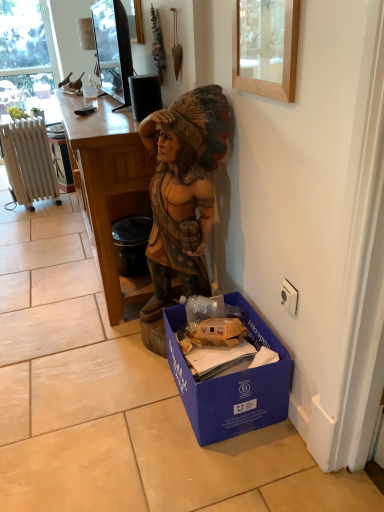
Question: Does white painted metal radiator at left have a lesser width compared to black glossy tv at upper center?

Choices:
 (A) no
 (B) yes

Answer: (A)

Question: Is the depth of white painted metal radiator at left less than that of black glossy tv at upper center?

Choices:
 (A) no
 (B) yes

Answer: (A)

Question: Is white painted metal radiator at left to the right of black glossy tv at upper center from the viewer's perspective?

Choices:
 (A) no
 (B) yes

Answer: (A)

Question: Is white painted metal radiator at left to the left of black glossy tv at upper center from the viewer's perspective?

Choices:
 (A) yes
 (B) no

Answer: (A)

Question: From the image's perspective, is white painted metal radiator at left on black glossy tv at upper center?

Choices:
 (A) yes
 (B) no

Answer: (B)

Question: Considering the positions of point (137, 151) and point (190, 415), is point (137, 151) closer or farther from the camera than point (190, 415)?

Choices:
 (A) farther
 (B) closer

Answer: (A)

Question: From a real-world perspective, is wooden desk at center above or below blue cardboard box at lower right?

Choices:
 (A) below
 (B) above

Answer: (B)

Question: Is wooden desk at center to the left or to the right of blue cardboard box at lower right in the image?

Choices:
 (A) left
 (B) right

Answer: (A)

Question: Relative to blue cardboard box at lower right, is wooden desk at center in front or behind?

Choices:
 (A) behind
 (B) front

Answer: (A)

Question: Based on their positions, is white painted metal radiator at left located to the left or right of wooden desk at center?

Choices:
 (A) left
 (B) right

Answer: (A)

Question: Relative to wooden desk at center, is white painted metal radiator at left in front or behind?

Choices:
 (A) behind
 (B) front

Answer: (A)

Question: From the image's perspective, is white painted metal radiator at left located above or below wooden desk at center?

Choices:
 (A) above
 (B) below

Answer: (A)

Question: In terms of width, does white painted metal radiator at left look wider or thinner when compared to wooden desk at center?

Choices:
 (A) thin
 (B) wide

Answer: (A)

Question: Relative to black glossy tv at upper center, is blue cardboard box at lower right in front or behind?

Choices:
 (A) front
 (B) behind

Answer: (A)

Question: From a real-world perspective, is blue cardboard box at lower right positioned above or below black glossy tv at upper center?

Choices:
 (A) below
 (B) above

Answer: (A)